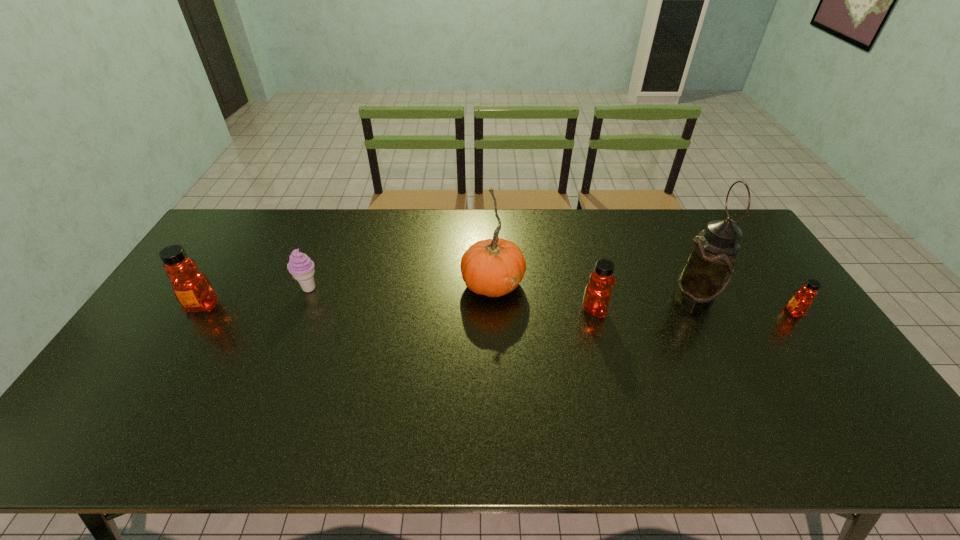
Locate an element on the screen. Image resolution: width=960 pixels, height=540 pixels. the leftmost honey is located at coordinates (192, 288).

The width and height of the screenshot is (960, 540). Find the location of `the second tallest honey`. the second tallest honey is located at coordinates (597, 295).

Locate an element on the screen. This screenshot has width=960, height=540. the third object from right to left is located at coordinates (597, 295).

The height and width of the screenshot is (540, 960). Find the location of `the shortest object`. the shortest object is located at coordinates (799, 304).

Image resolution: width=960 pixels, height=540 pixels. What are the coordinates of `the shortest honey` in the screenshot? It's located at (799, 304).

Locate an element on the screen. The height and width of the screenshot is (540, 960). pumpkin is located at coordinates (494, 267).

Locate an element on the screen. This screenshot has width=960, height=540. the fourth object from right to left is located at coordinates (494, 267).

What are the coordinates of `the fifth object from right to left` in the screenshot? It's located at (301, 267).

Locate an element on the screen. the tallest object is located at coordinates (708, 269).

Locate an element on the screen. Image resolution: width=960 pixels, height=540 pixels. the fifth object from left to right is located at coordinates (708, 269).